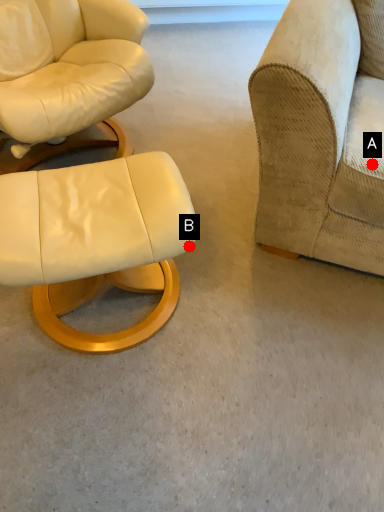
Question: Two points are circled on the image, labeled by A and B beside each circle. Which point is farther to the camera?

Choices:
 (A) A is further
 (B) B is further

Answer: (A)